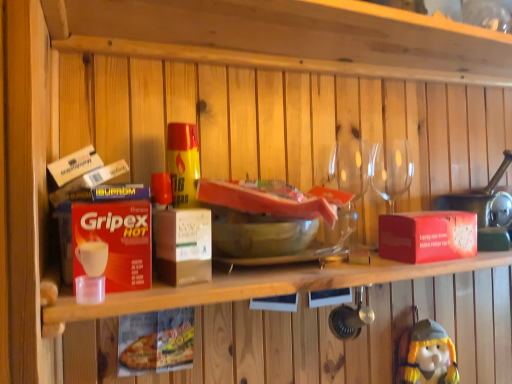
Consider the image. In order to face yellow plush toy at lower right, should I rotate leftwards or rightwards?

Rotate your view right by about 22.355°.

Image resolution: width=512 pixels, height=384 pixels. I want to click on wooden at upper center, the second shelf in the bottom-to-top sequence, so click(287, 37).

You are a GUI agent. You are given a task and a screenshot of the screen. Output one action in this format:
    pyautogui.click(x=<x>, y=<y>)
    Task: Click on the transparent glass wine glasses at upper right
    This screenshot has height=384, width=512.
    Given the screenshot: What is the action you would take?
    pyautogui.click(x=391, y=170)

At what (x,y) coordinates should I click in order to perform the action: click on red matte box at right, which is the second box in left-to-right order. Please return your answer as a coordinate pair (x, y). The image size is (512, 384). Looking at the image, I should click on (426, 236).

What's the angular difference between red matte gripex hot at left, the second box positioned from the right, and transparent glass wine glasses at upper right's facing directions?

7.06 degrees separate the facing orientations of red matte gripex hot at left, the second box positioned from the right, and transparent glass wine glasses at upper right.

Is red matte gripex hot at left, the second box positioned from the right, further to the viewer compared to transparent glass wine glasses at upper right?

No, it is not.

Considering the sizes of red matte gripex hot at left, which is the second box from back to front, and transparent glass wine glasses at upper right in the image, is red matte gripex hot at left, which is the second box from back to front, bigger or smaller than transparent glass wine glasses at upper right?

Considering their sizes, red matte gripex hot at left, which is the second box from back to front, takes up less space than transparent glass wine glasses at upper right.

Considering the relative sizes of red matte gripex hot at left, the 1th box from the front, and transparent glass wine glasses at upper right in the image provided, is red matte gripex hot at left, the 1th box from the front, thinner than transparent glass wine glasses at upper right?

No.

Who is more distant, wooden at upper center, acting as the 1th shelf starting from the top, or yellow plush toy at lower right?

yellow plush toy at lower right is behind.

Is yellow plush toy at lower right located within wooden at upper center, acting as the 1th shelf starting from the top?

Actually, yellow plush toy at lower right is outside wooden at upper center, acting as the 1th shelf starting from the top.

Is wooden at upper center, acting as the 1th shelf starting from the top, taller or shorter than yellow plush toy at lower right?

Clearly, wooden at upper center, acting as the 1th shelf starting from the top, is shorter compared to yellow plush toy at lower right.

From the picture: From the image's perspective, is wooden at upper center, acting as the 1th shelf starting from the top, over yellow plush toy at lower right?

Yes, from the image's perspective, wooden at upper center, acting as the 1th shelf starting from the top, is on top of yellow plush toy at lower right.

Between red cardboard box at upper center, the second shelf positioned from the top, and yellow plush toy at lower right, which one appears on the left side from the viewer's perspective?

red cardboard box at upper center, the second shelf positioned from the top, is more to the left.

Considering the relative sizes of red cardboard box at upper center, the second shelf positioned from the top, and yellow plush toy at lower right in the image provided, is red cardboard box at upper center, the second shelf positioned from the top, wider than yellow plush toy at lower right?

Yes, red cardboard box at upper center, the second shelf positioned from the top, is wider than yellow plush toy at lower right.

Does point (67, 293) come in front of point (456, 378)?

Yes, point (67, 293) is in front of point (456, 378).

From the image's perspective, which one is positioned higher, red cardboard box at upper center, the second shelf positioned from the top, or yellow plush toy at lower right?

red cardboard box at upper center, the second shelf positioned from the top.

Can you tell me how much wooden at upper center, acting as the 1th shelf starting from the top, and transparent glass wine glasses at upper right differ in facing direction?

They differ by 3.61 degrees in their facing directions.

Is there a large distance between wooden at upper center, the second shelf in the bottom-to-top sequence, and transparent glass wine glasses at upper right?

No, wooden at upper center, the second shelf in the bottom-to-top sequence, is not far away from transparent glass wine glasses at upper right.

This screenshot has width=512, height=384. I want to click on tableware that is below the wooden at upper center, the second shelf in the bottom-to-top sequence (from the image's perspective), so click(391, 170).

From a real-world perspective, is wooden at upper center, the second shelf in the bottom-to-top sequence, positioned over transparent glass wine glasses at upper right based on gravity?

Yes, from a real-world perspective, wooden at upper center, the second shelf in the bottom-to-top sequence, is above transparent glass wine glasses at upper right.

Is wooden at upper center, the second shelf in the bottom-to-top sequence, surrounded by red cardboard box at upper center, marked as the 1th shelf in a bottom-to-top arrangement?

No.

From the picture: Who is taller, red cardboard box at upper center, marked as the 1th shelf in a bottom-to-top arrangement, or wooden at upper center, the second shelf in the bottom-to-top sequence?

With more height is red cardboard box at upper center, marked as the 1th shelf in a bottom-to-top arrangement.

In the scene shown: Which is more distant, (461,260) or (430,21)?

The point (461,260) is behind.

Is there a large distance between red cardboard box at upper center, the second shelf positioned from the top, and wooden at upper center, the second shelf in the bottom-to-top sequence?

They are positioned close to each other.

In terms of size, does red matte gripex hot at left, which is the second box from back to front, appear bigger or smaller than wooden at upper center, the second shelf in the bottom-to-top sequence?

In the image, red matte gripex hot at left, which is the second box from back to front, appears to be smaller than wooden at upper center, the second shelf in the bottom-to-top sequence.

Looking at this image, between red matte gripex hot at left, the second box positioned from the right, and wooden at upper center, the second shelf in the bottom-to-top sequence, which one has larger width?

Wider between the two is wooden at upper center, the second shelf in the bottom-to-top sequence.

Is point (98, 257) farther from camera compared to point (387, 9)?

No, it is not.

From a real-world perspective, which object rests below the other?

red cardboard box at upper center, marked as the 1th shelf in a bottom-to-top arrangement.

Consider the image. Can you confirm if wooden at upper center, acting as the 1th shelf starting from the top, is wider than red cardboard box at upper center, the second shelf positioned from the top?

Incorrect, the width of wooden at upper center, acting as the 1th shelf starting from the top, does not surpass that of red cardboard box at upper center, the second shelf positioned from the top.

Which is behind, wooden at upper center, the second shelf in the bottom-to-top sequence, or red cardboard box at upper center, marked as the 1th shelf in a bottom-to-top arrangement?

Positioned behind is wooden at upper center, the second shelf in the bottom-to-top sequence.

Image resolution: width=512 pixels, height=384 pixels. Identify the location of shelf below the wooden at upper center, acting as the 1th shelf starting from the top (from the image's perspective). (261, 285).

What are the coordinates of `tableware on the right of red matte gripex hot at left, the 1th box from the left` in the screenshot? It's located at (391, 170).

From the image's perspective, count 2nd shelfs upward from the yellow plush toy at lower right and point to it. Please provide its 2D coordinates.

[(287, 37)]

Which object lies further to the anchor point red matte gripex hot at left, which is the second box from back to front, red cardboard box at upper center, the second shelf positioned from the top, or transparent glass wine glasses at upper right?

Based on the image, transparent glass wine glasses at upper right appears to be further to red matte gripex hot at left, which is the second box from back to front.

From the image, which object appears to be nearer to wooden at upper center, acting as the 1th shelf starting from the top, yellow plush toy at lower right or red matte gripex hot at left, the second box positioned from the right?

red matte gripex hot at left, the second box positioned from the right, is closer to wooden at upper center, acting as the 1th shelf starting from the top.

Looking at this image, from the image, which object appears to be farther from yellow plush toy at lower right, transparent glass wine glasses at upper right or red cardboard box at upper center, the second shelf positioned from the top?

Among the two, red cardboard box at upper center, the second shelf positioned from the top, is located further to yellow plush toy at lower right.

Which object lies nearer to the anchor point yellow plush toy at lower right, red cardboard box at upper center, the second shelf positioned from the top, or transparent glass wine glasses at upper right?

Among the two, transparent glass wine glasses at upper right is located nearer to yellow plush toy at lower right.

Estimate the real-world distances between objects in this image. Which object is further from transparent glass wine glasses at upper right, yellow plush toy at lower right or red matte gripex hot at left, the 1th box from the left?

red matte gripex hot at left, the 1th box from the left, is further to transparent glass wine glasses at upper right.

From the image, which object appears to be farther from red matte gripex hot at left, the 1th box from the front, yellow plush toy at lower right or transparent glass wine glasses at upper right?

yellow plush toy at lower right.

Consider the image. Estimate the real-world distances between objects in this image. Which object is further from red matte gripex hot at left, which is the second box from back to front, red matte box at right, the 2th box from the front, or transparent glass wine glasses at upper right?

Among the two, transparent glass wine glasses at upper right is located further to red matte gripex hot at left, which is the second box from back to front.

From the image, which object appears to be nearer to yellow plush toy at lower right, transparent glass wine glasses at upper right or wooden at upper center, acting as the 1th shelf starting from the top?

The object closer to yellow plush toy at lower right is transparent glass wine glasses at upper right.

Where is `shelf between wooden at upper center, acting as the 1th shelf starting from the top, and yellow plush toy at lower right in the up-down direction`? shelf between wooden at upper center, acting as the 1th shelf starting from the top, and yellow plush toy at lower right in the up-down direction is located at coordinates (261, 285).

This screenshot has width=512, height=384. I want to click on box situated between red matte gripex hot at left, which is the second box from back to front, and yellow plush toy at lower right from left to right, so click(x=426, y=236).

Find the location of a particular element. tableware that lies between wooden at upper center, acting as the 1th shelf starting from the top, and yellow plush toy at lower right from top to bottom is located at coordinates (391, 170).

You are a GUI agent. You are given a task and a screenshot of the screen. Output one action in this format:
    pyautogui.click(x=<x>, y=<y>)
    Task: Click on the shelf positioned between red cardboard box at upper center, marked as the 1th shelf in a bottom-to-top arrangement, and transparent glass wine glasses at upper right from near to far
    
    Given the screenshot: What is the action you would take?
    pyautogui.click(x=287, y=37)